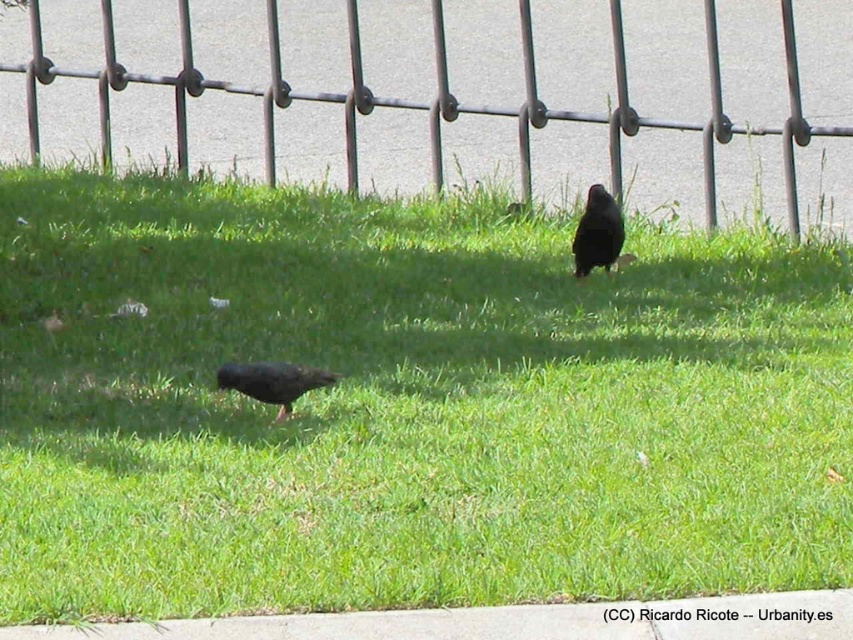
You are standing at the point marked by point (433, 97) and want to walk towards the metallic wire fence at upper center. Which direction should you go?

The point (433, 97) is already the location of the metallic wire fence at upper center, so you are already at the metallic wire fence at upper center.

You are a photographer trying to capture a clear shot of the shiny black bird at upper center without the metallic wire fence at upper center obstructing the view. Based on their heights, can you position yourself so that the fence is below the bird in your frame?

The metallic wire fence at upper center has a lesser height compared to the shiny black bird at upper center. Therefore, positioning yourself lower to ensure the fence is below the bird in your frame would allow you to capture the bird without obstruction.